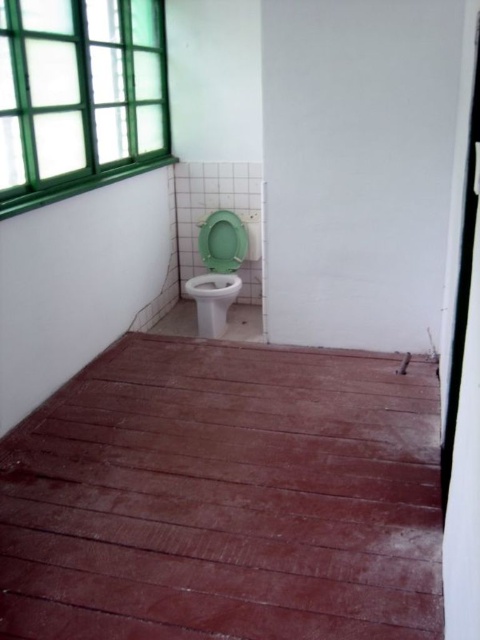
Is green glass window at upper left smaller than green plastic toilet bowl at center?

Actually, green glass window at upper left might be larger than green plastic toilet bowl at center.

Is green glass window at upper left positioned behind green plastic toilet bowl at center?

No, green glass window at upper left is in front of green plastic toilet bowl at center.

Between point (55, 192) and point (215, 292), which one is positioned behind?

The point (215, 292) is more distant.

Identify the location of green glass window at upper left. The image size is (480, 640). (80, 97).